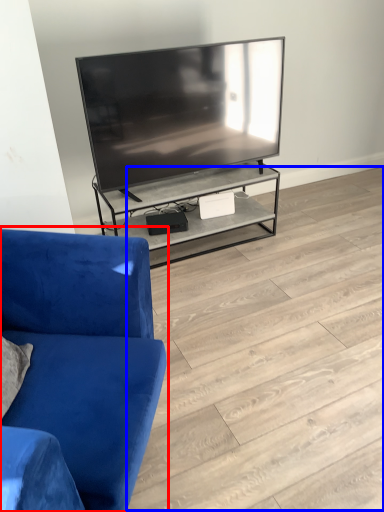
Question: Which point is further to the camera, studio couch (highlighted by a red box) or tile (highlighted by a blue box)?

Choices:
 (A) studio couch
 (B) tile

Answer: (B)